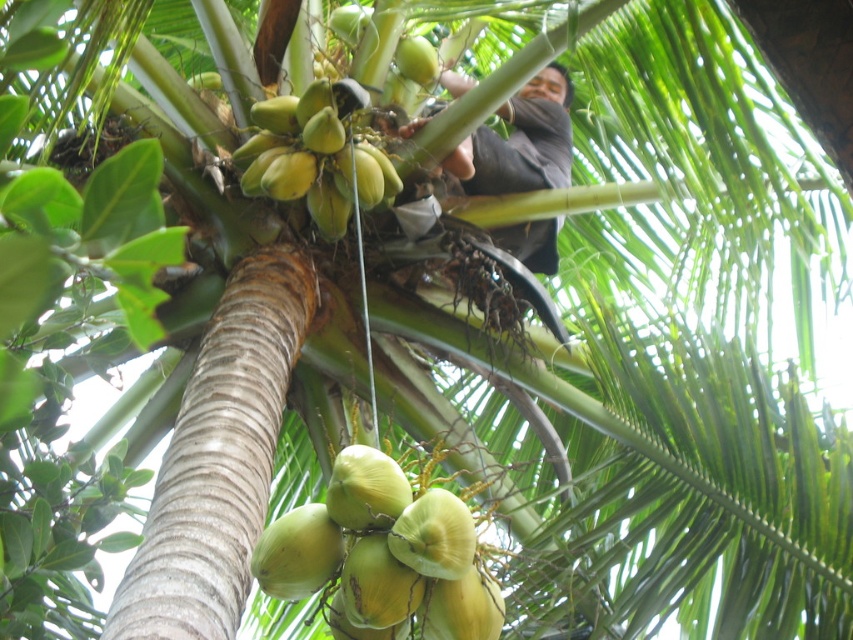
You are a coconut farmer looking up at the palm tree. You see the green matte coconut at center and the green matte coconut at upper center. Which one is positioned higher up on the tree?

The green matte coconut at upper center is positioned higher up on the tree than the green matte coconut at center.

You are a coconut farmer trying to reach the green matte coconut at upper center. There is a dark brown fabric at center that might block your path. Can you reach the coconut without moving the fabric?

The green matte coconut at upper center is positioned on the left side of the dark brown fabric at center, so you can reach it without moving the fabric by approaching from the left side.